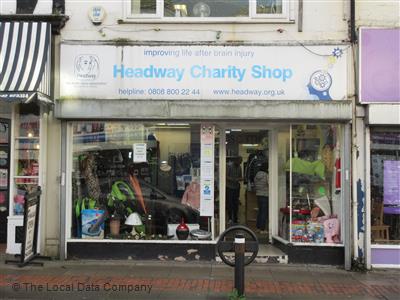
Where is `phone`? The image size is (400, 300). phone is located at coordinates (167, 91).